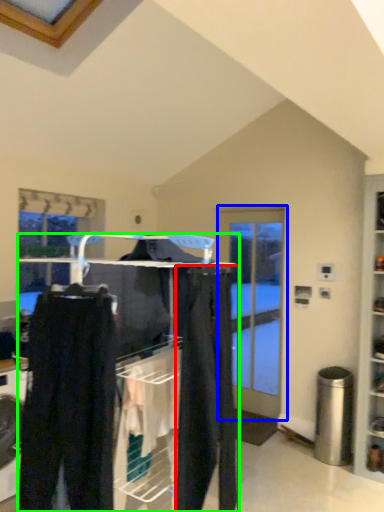
Question: Considering the real-world distances, which object is closest to clothing (highlighted by a red box)? door (highlighted by a blue box) or closet (highlighted by a green box).

Choices:
 (A) door
 (B) closet

Answer: (B)